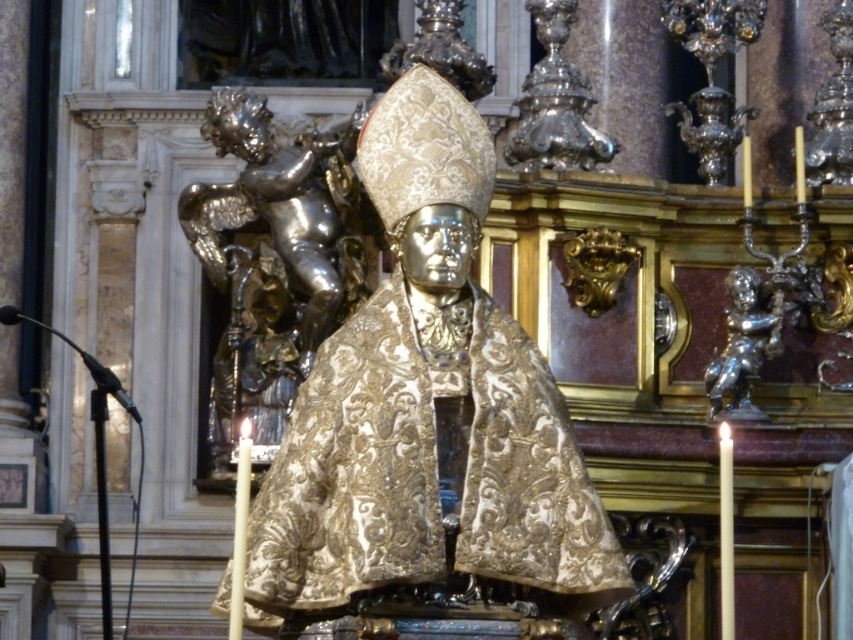
Question: Is shiny silver cherub at left above shiny silver cherub at right?

Choices:
 (A) yes
 (B) no

Answer: (A)

Question: Which point is farther from the camera taking this photo?

Choices:
 (A) (399, 337)
 (B) (750, 294)

Answer: (B)

Question: Observing the image, what is the correct spatial positioning of gold embroidered cape at center in reference to shiny silver cherub at left?

Choices:
 (A) below
 (B) above

Answer: (A)

Question: Considering the real-world distances, which object is farthest from the shiny silver cherub at right?

Choices:
 (A) shiny silver cherub at left
 (B) gold embroidered cape at center

Answer: (A)

Question: Does shiny silver cherub at left lie in front of shiny silver cherub at right?

Choices:
 (A) no
 (B) yes

Answer: (A)

Question: Which of the following is the closest to the observer?

Choices:
 (A) (312, 195)
 (B) (457, 554)
 (C) (747, 316)

Answer: (B)